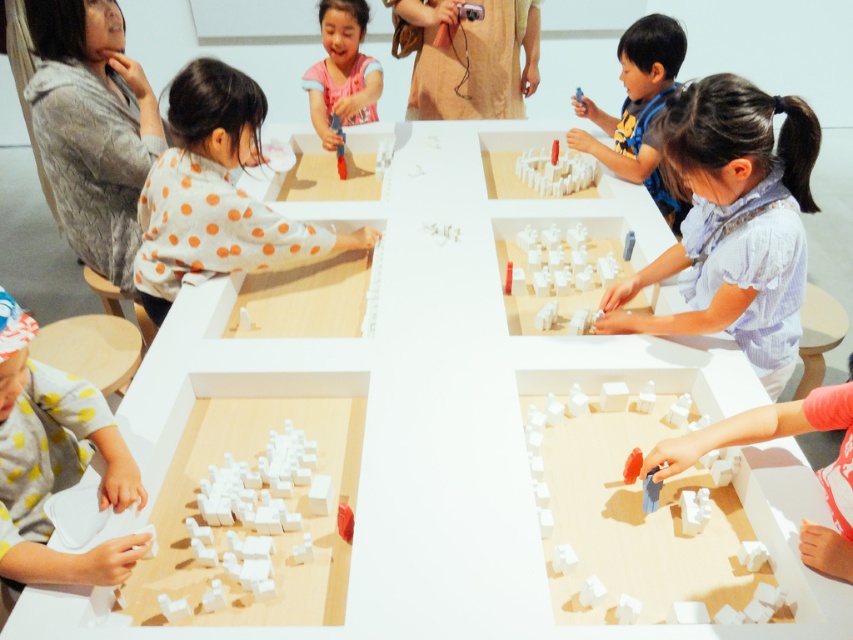
You are a child participating in the exhibit and want to place the white matte toy at center onto the yellow polka dot fabric at lower left. Can you move it directly to the fabric without moving any other objects?

The yellow polka dot fabric at lower left is to the left of the white matte toy at center, so yes, you can move the white matte toy at center directly to the yellow polka dot fabric at lower left without moving other objects.

You are a child participating in this exhibit and want to reach the white matte building at center from your current position near the matte pink shirt at upper center. Can you comfortably stretch your arm to touch it without moving your body?

The distance between the matte pink shirt at upper center and the white matte building at center is 33.65 inches. Since the average human arm span is about 30 inches, you would not be able to comfortably reach the white matte building at center without moving your body.